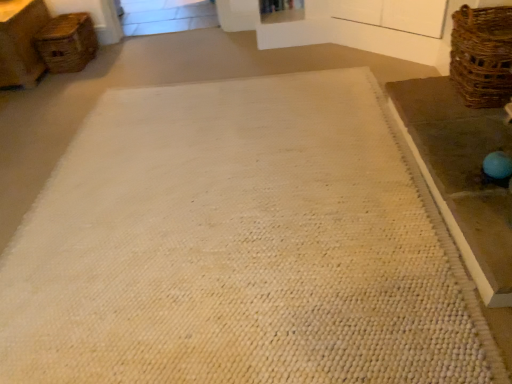
Question: Considering the relative sizes of brown woven basket at right, the 1th basket positioned from the front, and woven brown basket at upper left, placed as the 1th basket when sorted from back to front, in the image provided, is brown woven basket at right, the 1th basket positioned from the front, bigger than woven brown basket at upper left, placed as the 1th basket when sorted from back to front,?

Choices:
 (A) no
 (B) yes

Answer: (A)

Question: Is brown woven basket at right, arranged as the 2th basket when viewed from the left, at the right side of woven brown basket at upper left, the 2th basket in the right-to-left sequence?

Choices:
 (A) yes
 (B) no

Answer: (A)

Question: Considering the relative sizes of brown woven basket at right, which is the 2th basket in back-to-front order, and woven brown basket at upper left, the second basket when ordered from front to back, in the image provided, is brown woven basket at right, which is the 2th basket in back-to-front order, smaller than woven brown basket at upper left, the second basket when ordered from front to back,?

Choices:
 (A) no
 (B) yes

Answer: (B)

Question: Considering the relative sizes of brown woven basket at right, which is the 2th basket in back-to-front order, and woven brown basket at upper left, placed as the 1th basket when sorted from left to right, in the image provided, is brown woven basket at right, which is the 2th basket in back-to-front order, thinner than woven brown basket at upper left, placed as the 1th basket when sorted from left to right,?

Choices:
 (A) yes
 (B) no

Answer: (A)

Question: Is brown woven basket at right, which is the second basket in top-to-bottom order, completely or partially outside of woven brown basket at upper left, the second basket when ordered from front to back?

Choices:
 (A) yes
 (B) no

Answer: (A)

Question: Is brown woven basket at right, arranged as the 2th basket when viewed from the left, shorter than woven brown basket at upper left, which appears as the 1th basket when viewed from the top?

Choices:
 (A) yes
 (B) no

Answer: (B)

Question: Considering the relative sizes of brown woven table at right and woven brown basket at upper left, the 2th basket in the right-to-left sequence, in the image provided, is brown woven table at right smaller than woven brown basket at upper left, the 2th basket in the right-to-left sequence,?

Choices:
 (A) yes
 (B) no

Answer: (B)

Question: Does brown woven table at right have a lesser height compared to woven brown basket at upper left, placed as the 1th basket when sorted from left to right?

Choices:
 (A) no
 (B) yes

Answer: (B)

Question: Is brown woven table at right further to the viewer compared to woven brown basket at upper left, placed as the 1th basket when sorted from left to right?

Choices:
 (A) yes
 (B) no

Answer: (B)

Question: From a real-world perspective, is brown woven table at right physically above woven brown basket at upper left, the second basket when ordered from front to back?

Choices:
 (A) no
 (B) yes

Answer: (A)

Question: Is brown woven table at right to the left of woven brown basket at upper left, the 2th basket in the right-to-left sequence, from the viewer's perspective?

Choices:
 (A) no
 (B) yes

Answer: (A)

Question: Does brown woven table at right have a lesser width compared to woven brown basket at upper left, placed as the second basket when sorted from bottom to top?

Choices:
 (A) yes
 (B) no

Answer: (B)

Question: From the image's perspective, would you say brown woven basket at right, which is the second basket in top-to-bottom order, is positioned over brown woven table at right?

Choices:
 (A) no
 (B) yes

Answer: (B)